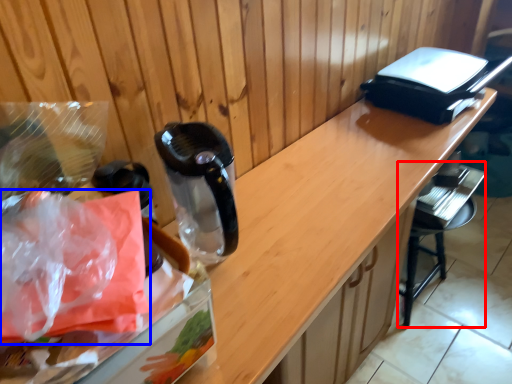
Question: Which object is closer to the camera taking this photo, bar stool (highlighted by a red box) or plastic bag (highlighted by a blue box)?

Choices:
 (A) bar stool
 (B) plastic bag

Answer: (B)